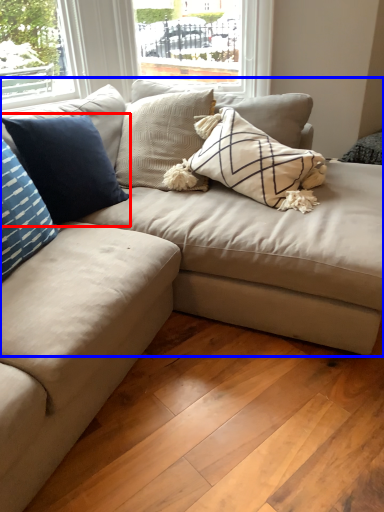
Question: Among these objects, which one is farthest to the camera, pillow (highlighted by a red box) or studio couch (highlighted by a blue box)?

Choices:
 (A) pillow
 (B) studio couch

Answer: (A)